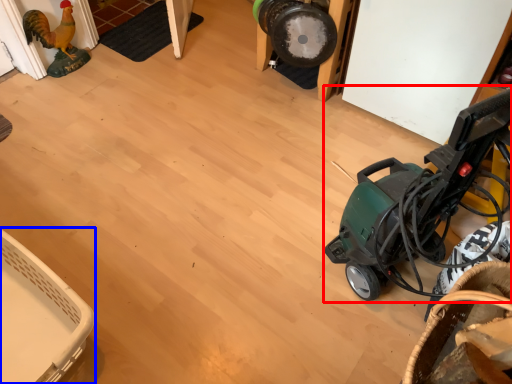
Question: Which of the following is the closest to the observer, baby carriage (highlighted by a red box) or basket (highlighted by a blue box)?

Choices:
 (A) baby carriage
 (B) basket

Answer: (A)